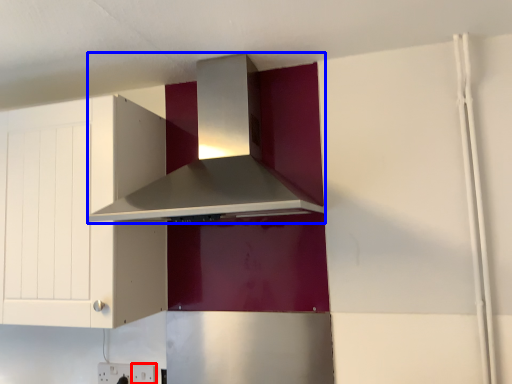
Question: Among these objects, which one is farthest to the camera, electric outlet (highlighted by a red box) or home appliance (highlighted by a blue box)?

Choices:
 (A) electric outlet
 (B) home appliance

Answer: (A)